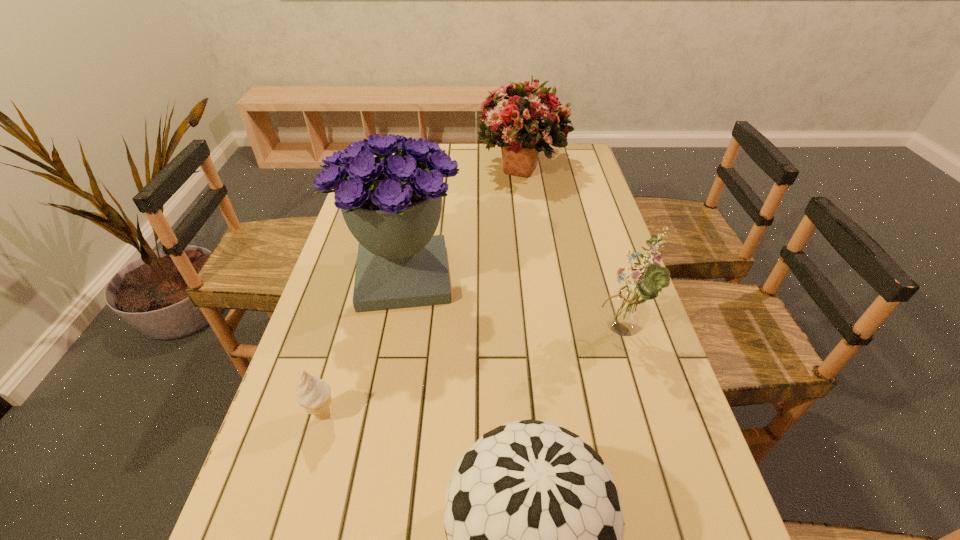
The width and height of the screenshot is (960, 540). I want to click on object identified as the fourth closest to the tallest object, so point(535,529).

Locate which bouquet is the closest to the leftmost bouquet. Please provide its 2D coordinates. Your answer should be formatted as a tuple, i.e. [(x, y)], where the tuple contains the x and y coordinates of a point satisfying the conditions above.

[(525, 120)]

At what (x,y) coordinates should I click in order to perform the action: click on bouquet that is the closest one to the farthest bouquet. Please return your answer as a coordinate pair (x, y). This screenshot has height=540, width=960. Looking at the image, I should click on (392, 204).